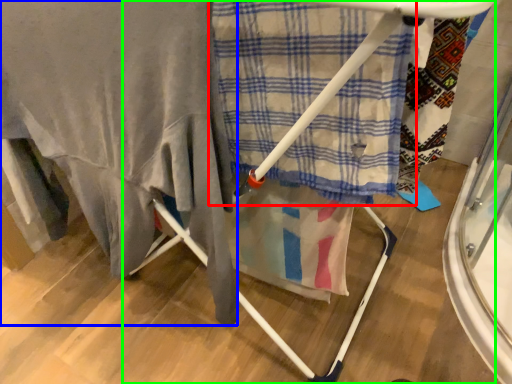
Question: Estimate the real-world distances between objects in this image. Which object is closer to cloth (highlighted by a red box), blanket (highlighted by a blue box) or furniture (highlighted by a green box)?

Choices:
 (A) blanket
 (B) furniture

Answer: (B)